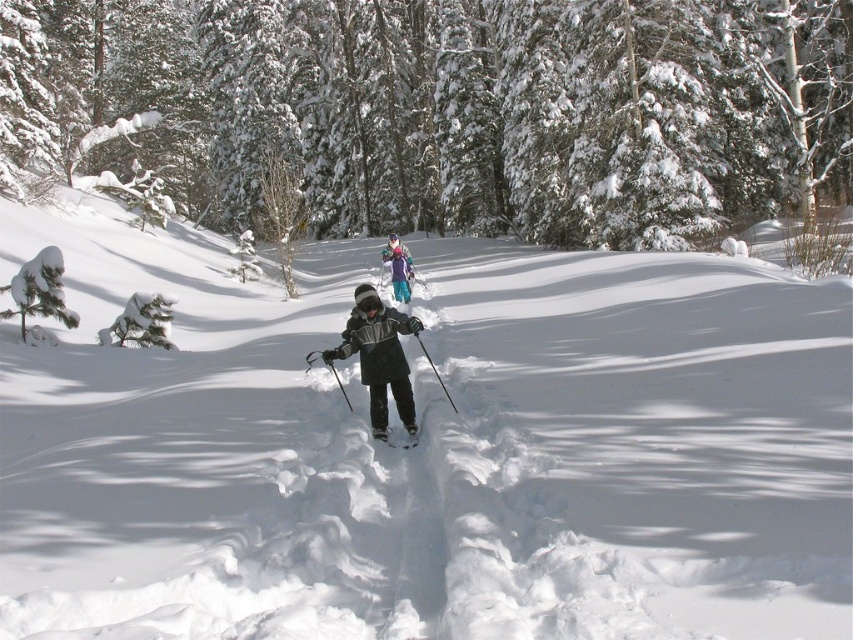
You are a photographer trying to capture a clear photo of the dark gray fleece jacket at center and the white matte ski at center. The camera has a minimum focus distance of 12 inches. Can you take a photo of both objects without moving the camera?

The dark gray fleece jacket at center and the white matte ski at center are 12.72 inches apart. Since the minimum focus distance is 12 inches, the camera can focus on both objects as they are within the required distance.

You are a winter sports enthusiast planning to ski down the slope. You see the white snow ski slope at center and the white matte ski at center. Which object is closer to you as you prepare to start your descent?

The white snow ski slope at center is closer to the viewer than the white matte ski at center, so the slope is closer as you prepare to start your descent.

You are a photographer trying to capture a winter scene with the dark gray fleece jacket at center and the white matte ski at center. Based on their positions, which object should you adjust your camera to focus on first if you want to capture both in the same frame?

The dark gray fleece jacket at center is to the left of the white matte ski at center, so you should focus on the dark gray fleece jacket at center first to ensure both are in frame.